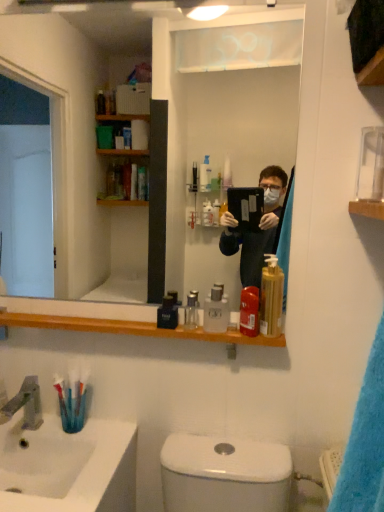
Question: Is satin nickel faucet at sink left positioned behind translucent plastic toothbrush at lower left?

Choices:
 (A) no
 (B) yes

Answer: (A)

Question: Could translucent plastic toothbrush at lower left be considered to be inside satin nickel faucet at sink left?

Choices:
 (A) yes
 (B) no

Answer: (B)

Question: Can you confirm if satin nickel faucet at sink left is bigger than translucent plastic toothbrush at lower left?

Choices:
 (A) no
 (B) yes

Answer: (B)

Question: Does satin nickel faucet at sink left have a lesser width compared to translucent plastic toothbrush at lower left?

Choices:
 (A) no
 (B) yes

Answer: (A)

Question: Is satin nickel faucet at sink left turned away from translucent plastic toothbrush at lower left?

Choices:
 (A) no
 (B) yes

Answer: (A)

Question: From a real-world perspective, is satin nickel faucet at sink left physically below translucent plastic toothbrush at lower left?

Choices:
 (A) no
 (B) yes

Answer: (B)

Question: Does clear plastic bottle at center, the 3th mouthwash in the left-to-right sequence, appear on the left side of clear glass mirror at upper center?

Choices:
 (A) yes
 (B) no

Answer: (B)

Question: Is clear plastic bottle at center, which ranks as the 2th mouthwash in right-to-left order, closer to camera compared to clear glass mirror at upper center?

Choices:
 (A) no
 (B) yes

Answer: (A)

Question: From the image's perspective, is clear plastic bottle at center, the 3th mouthwash in the left-to-right sequence, below clear glass mirror at upper center?

Choices:
 (A) no
 (B) yes

Answer: (B)

Question: Does clear plastic bottle at center, which ranks as the 2th mouthwash in right-to-left order, have a lesser height compared to clear glass mirror at upper center?

Choices:
 (A) yes
 (B) no

Answer: (A)

Question: Does clear plastic bottle at center, the 3th mouthwash in the left-to-right sequence, have a greater height compared to clear glass mirror at upper center?

Choices:
 (A) no
 (B) yes

Answer: (A)

Question: From the image's perspective, is clear plastic bottle at center, the 3th mouthwash in the left-to-right sequence, above clear glass mirror at upper center?

Choices:
 (A) no
 (B) yes

Answer: (A)

Question: Does translucent plastic toothbrush at lower left come behind white glossy sink at lower left?

Choices:
 (A) no
 (B) yes

Answer: (B)